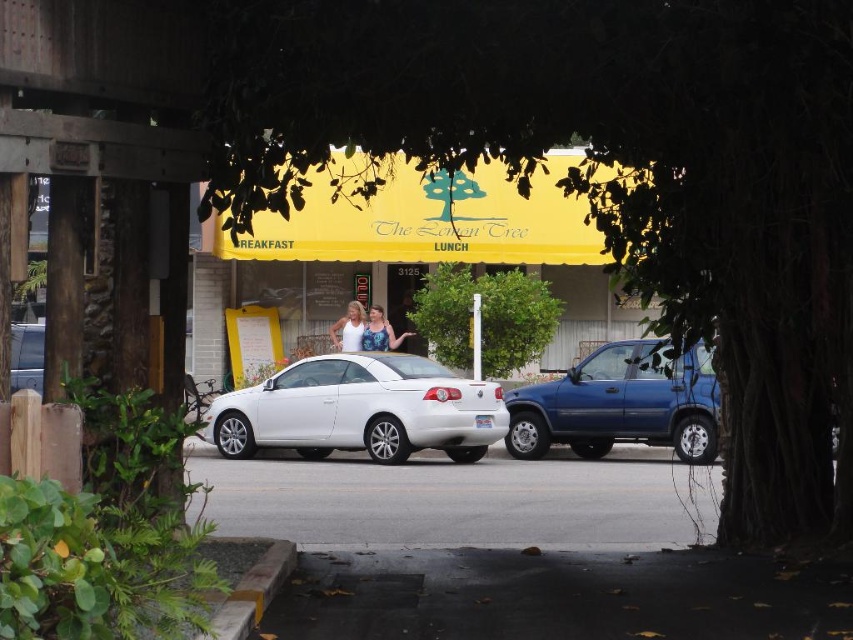
Is green leafy tree at center bigger than white matte tank top at center?

Yes.

Does green leafy tree at center appear on the left side of white matte tank top at center?

No, green leafy tree at center is not to the left of white matte tank top at center.

Is point (732, 445) closer to viewer compared to point (343, 317)?

Yes.

Identify the location of green leafy tree at center. Image resolution: width=853 pixels, height=640 pixels. (608, 179).

This screenshot has height=640, width=853. Describe the element at coordinates (360, 410) in the screenshot. I see `white glossy convertible at center` at that location.

Which is more to the right, white glossy convertible at center or green leafy bush at center?

green leafy bush at center is more to the right.

This screenshot has height=640, width=853. Find the location of `white glossy convertible at center`. white glossy convertible at center is located at coordinates (360, 410).

Between green leafy tree at center and metallic silver sedan at left, which one appears on the left side from the viewer's perspective?

metallic silver sedan at left is more to the left.

At what (x,y) coordinates should I click in order to perform the action: click on green leafy tree at center. Please return your answer as a coordinate pair (x, y). The width and height of the screenshot is (853, 640). Looking at the image, I should click on (608, 179).